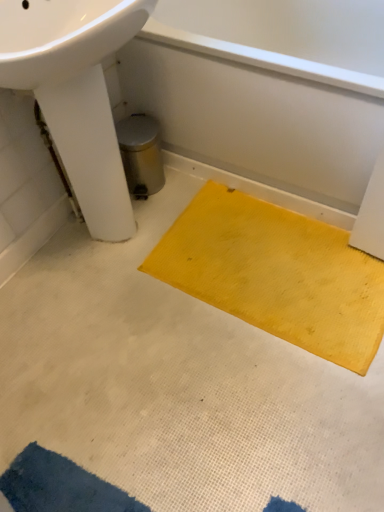
Question: Is yellow rubber mat at lower right positioned in front of blue textured mat at lower left, the 1th doormat when ordered from front to back?

Choices:
 (A) yes
 (B) no

Answer: (B)

Question: Can you confirm if yellow rubber mat at lower right is shorter than blue textured mat at lower left, the 1th doormat when ordered from front to back?

Choices:
 (A) yes
 (B) no

Answer: (B)

Question: Can you confirm if yellow rubber mat at lower right is thinner than blue textured mat at lower left, the 1th doormat when ordered from left to right?

Choices:
 (A) yes
 (B) no

Answer: (B)

Question: Is blue textured mat at lower left, the 2th doormat viewed from the right, inside yellow rubber mat at lower right?

Choices:
 (A) no
 (B) yes

Answer: (A)

Question: Is yellow rubber mat at lower right positioned behind blue textured mat at lower left, the 2th doormat when ordered from back to front?

Choices:
 (A) yes
 (B) no

Answer: (A)

Question: Is yellow rubber mat at lower right at the right side of blue textured mat at lower left, the 2th doormat viewed from the right?

Choices:
 (A) yes
 (B) no

Answer: (A)

Question: Considering the relative sizes of yellow rubber mat at lower right and yellow rubber mat at center, arranged as the 1th doormat when viewed from the right, in the image provided, is yellow rubber mat at lower right thinner than yellow rubber mat at center, arranged as the 1th doormat when viewed from the right,?

Choices:
 (A) no
 (B) yes

Answer: (A)

Question: Does yellow rubber mat at lower right appear on the right side of yellow rubber mat at center, the 1th doormat in the back-to-front sequence?

Choices:
 (A) yes
 (B) no

Answer: (A)

Question: Does yellow rubber mat at lower right have a lesser height compared to yellow rubber mat at center, the 1th doormat in the back-to-front sequence?

Choices:
 (A) no
 (B) yes

Answer: (A)

Question: Is yellow rubber mat at lower right surrounding yellow rubber mat at center, arranged as the 1th doormat when viewed from the right?

Choices:
 (A) yes
 (B) no

Answer: (B)

Question: Is yellow rubber mat at lower right further to camera compared to yellow rubber mat at center, which ranks as the second doormat in front-to-back order?

Choices:
 (A) no
 (B) yes

Answer: (A)

Question: Is there a large distance between yellow rubber mat at lower right and yellow rubber mat at center, which is the second doormat from bottom to top?

Choices:
 (A) yes
 (B) no

Answer: (B)

Question: Can you confirm if white glossy sink at upper left is wider than yellow rubber mat at center, arranged as the 1th doormat when viewed from the right?

Choices:
 (A) yes
 (B) no

Answer: (B)